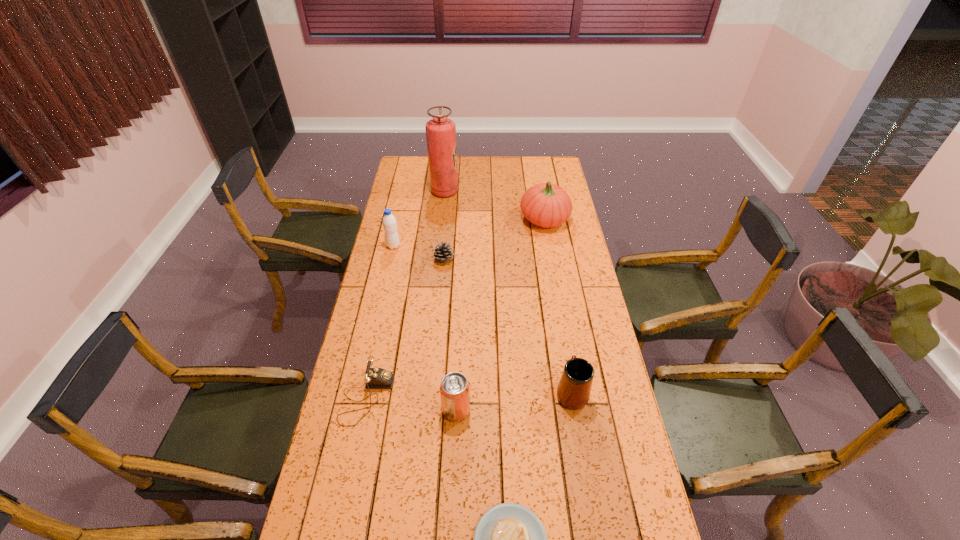
Identify the location of vacant region between the soda can and the water bottle. This screenshot has width=960, height=540. (425, 328).

Image resolution: width=960 pixels, height=540 pixels. In order to click on vacant space in between the mug and the tallest object in this screenshot , I will do `click(508, 292)`.

Locate an element on the screen. This screenshot has width=960, height=540. object that stands as the closest to the pinecone is located at coordinates (389, 222).

In order to click on object that is the second closest one to the telephone in this screenshot , I will do `click(509, 539)`.

The width and height of the screenshot is (960, 540). In order to click on free space that satisfies the following two spatial constraints: 1. on the front side of the fourth farthest object; 2. on the left side of the soda can in this screenshot , I will do `click(431, 410)`.

What are the coordinates of `free space that satisfies the following two spatial constraints: 1. on the dial of the telephone; 2. on the left side of the soda can` in the screenshot? It's located at (364, 410).